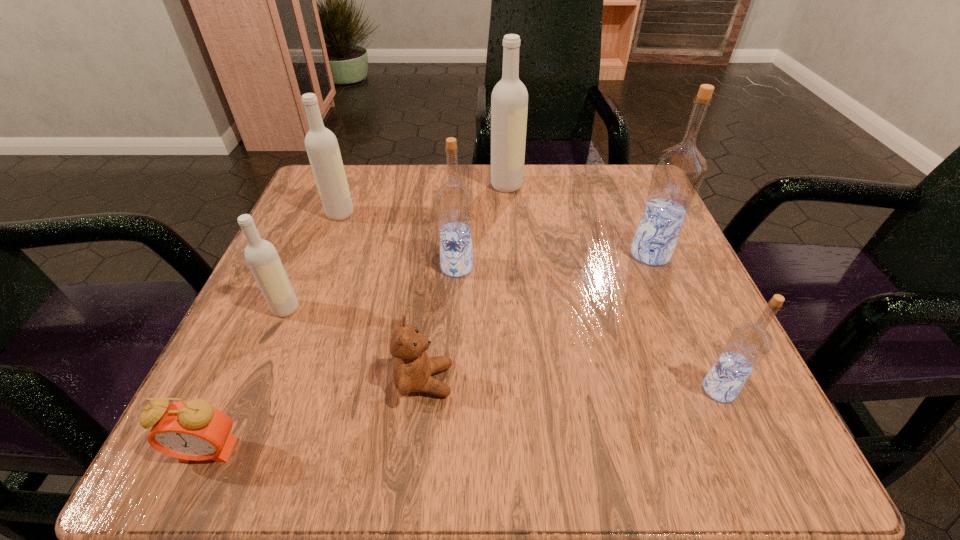
At what (x,y) coordinates should I click in order to perform the action: click on vacant space located on the face of the teddy bear. Please return your answer as a coordinate pair (x, y). This screenshot has width=960, height=540. Looking at the image, I should click on (583, 381).

What are the coordinates of `vodka located at the near edge` in the screenshot? It's located at (748, 344).

What are the coordinates of `teddy bear at the near edge` in the screenshot? It's located at (412, 368).

Identify the location of alarm clock that is at the near edge. The height and width of the screenshot is (540, 960). tap(194, 430).

At what (x,y) coordinates should I click in order to perform the action: click on alarm clock situated at the left edge. Please return your answer as a coordinate pair (x, y). Image resolution: width=960 pixels, height=540 pixels. Looking at the image, I should click on coord(194,430).

Identify the location of object at the far left corner. This screenshot has height=540, width=960. (321, 144).

Identify the location of object located at the near left corner. (194, 430).

Find the location of a particular element. object positioned at the near right corner is located at coordinates (748, 344).

Where is `vacant space at the far edge`? vacant space at the far edge is located at coordinates (485, 189).

Where is `vacant area at the near edge of the desktop`? The image size is (960, 540). vacant area at the near edge of the desktop is located at coordinates (580, 427).